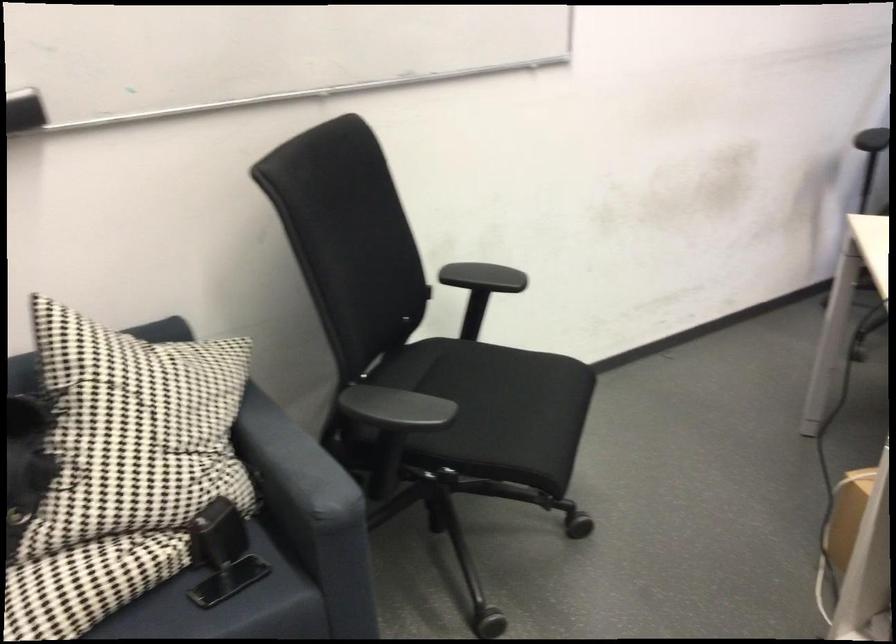
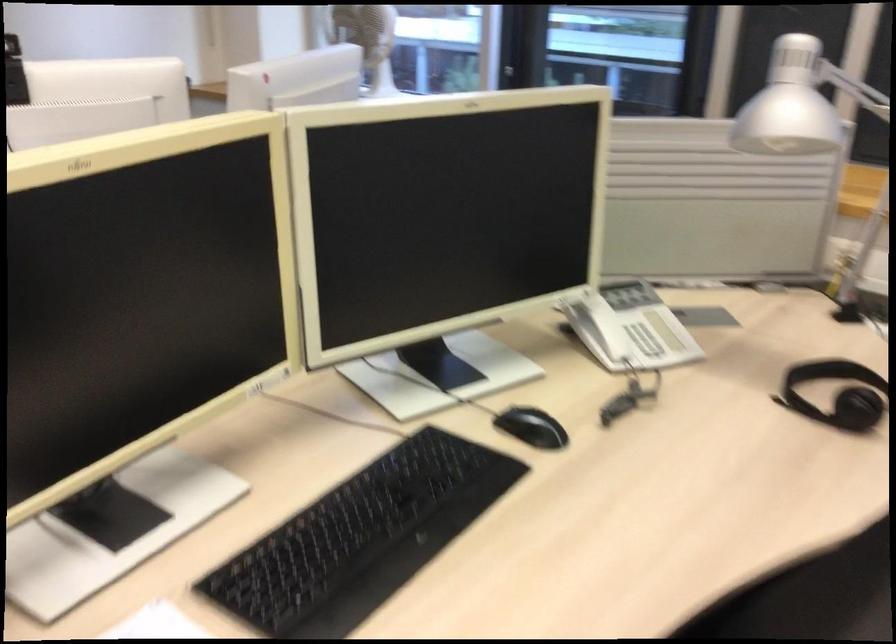
Question: Which direction would the cameraman need to move to produce the second image? Reply with the corresponding letter.

Choices:
 (A) Left
 (B) Right
 (C) Forward
 (D) Backward

Answer: (B)